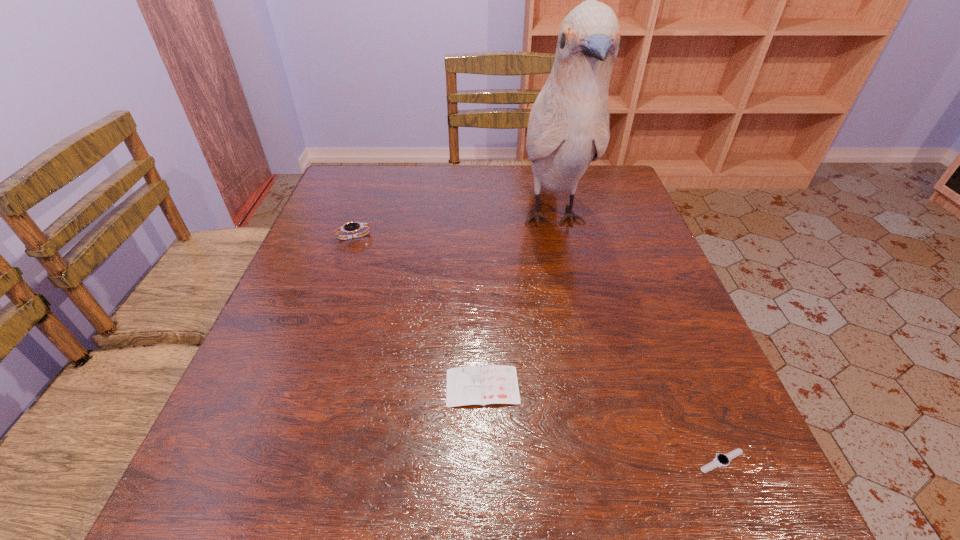
The image size is (960, 540). In order to click on the tallest object in this screenshot , I will do `click(568, 128)`.

You are a GUI agent. You are given a task and a screenshot of the screen. Output one action in this format:
    pyautogui.click(x=<x>, y=<y>)
    Task: Click on the second object from right to left
    Image resolution: width=960 pixels, height=540 pixels.
    Given the screenshot: What is the action you would take?
    pyautogui.click(x=568, y=128)

Find the location of a particular element. The height and width of the screenshot is (540, 960). the farther watch is located at coordinates (351, 227).

I want to click on the taller watch, so click(351, 227).

This screenshot has width=960, height=540. I want to click on the third farthest object, so click(x=492, y=384).

Where is `the third object from right to left`? The height and width of the screenshot is (540, 960). the third object from right to left is located at coordinates (492, 384).

Locate an element on the screen. The image size is (960, 540). the nearest object is located at coordinates pyautogui.click(x=721, y=460).

Where is `the shorter watch`? the shorter watch is located at coordinates (721, 460).

Find the location of `free spot located 0.080m on the face of the tallest object`. free spot located 0.080m on the face of the tallest object is located at coordinates [572, 306].

Where is `vacant point located on the front of the left watch`? This screenshot has width=960, height=540. vacant point located on the front of the left watch is located at coordinates (331, 303).